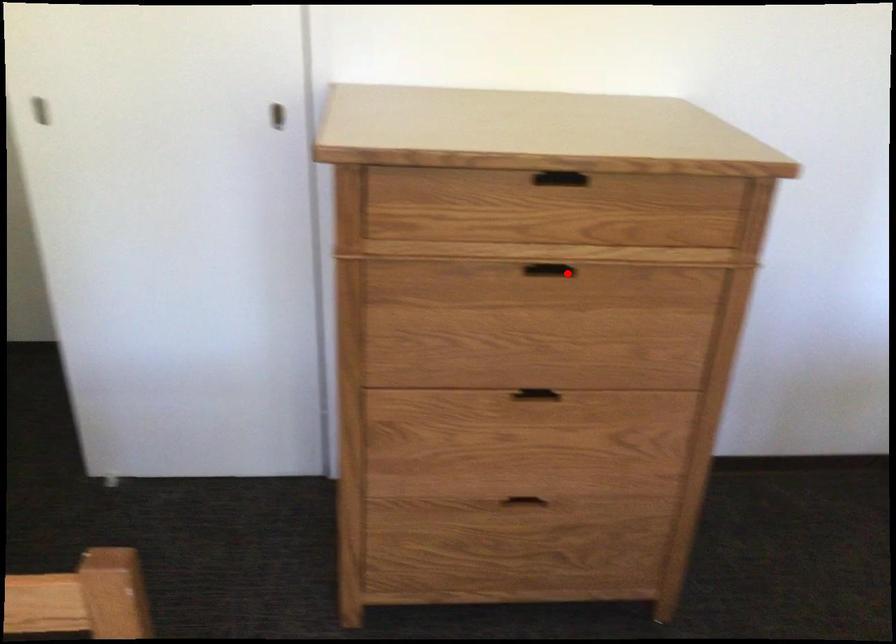
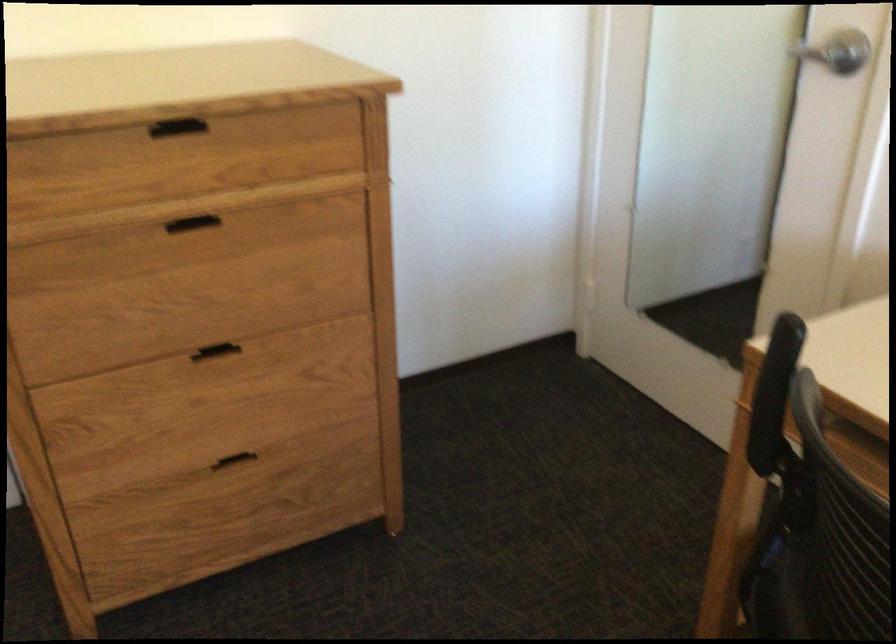
Find the pixel in the second image that matches the highlighted location in the first image.

(211, 227)